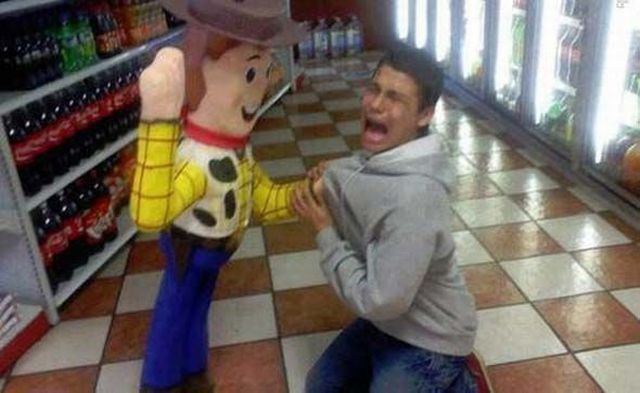
The image size is (640, 393). I want to click on floor, so [294, 324].